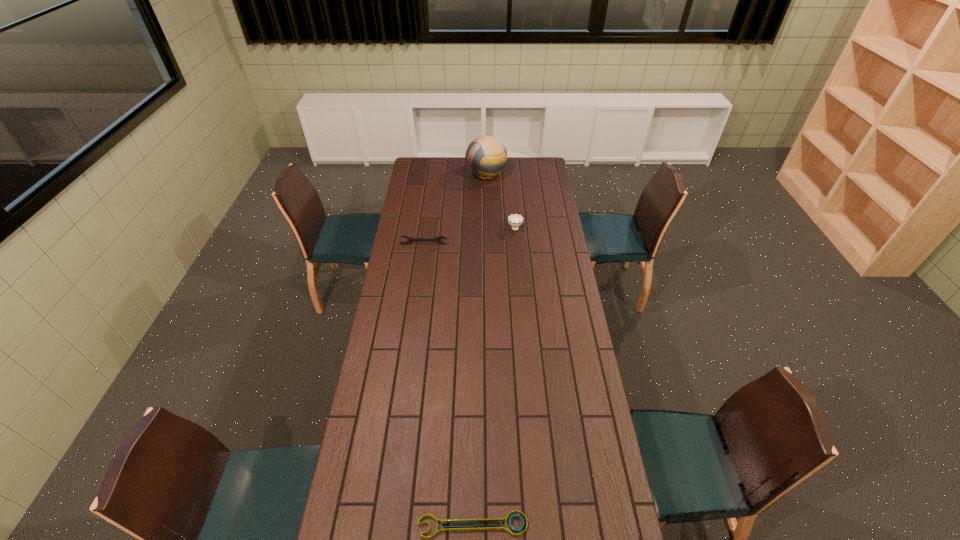
Where is `object that is the nearest to the second nearest object`? The height and width of the screenshot is (540, 960). object that is the nearest to the second nearest object is located at coordinates (515, 220).

Find the location of `the second closest object to the second nearest object`. the second closest object to the second nearest object is located at coordinates (486, 157).

You are a GUI agent. You are given a task and a screenshot of the screen. Output one action in this format:
    pyautogui.click(x=<x>, y=<y>)
    Task: Click on the free space in the image that satisfies the following two spatial constraints: 1. on the open ends of the taller wrench; 2. on the right side of the shortest object
    This screenshot has width=960, height=540.
    Given the screenshot: What is the action you would take?
    pyautogui.click(x=386, y=525)

Where is `free space that satisfies the following two spatial constraints: 1. on the open ends of the third farthest object; 2. on the right side of the shorter wrench`? free space that satisfies the following two spatial constraints: 1. on the open ends of the third farthest object; 2. on the right side of the shorter wrench is located at coordinates (386, 525).

You are a GUI agent. You are given a task and a screenshot of the screen. Output one action in this format:
    pyautogui.click(x=<x>, y=<y>)
    Task: Click on the free space that satisfies the following two spatial constraints: 1. on the open ends of the second shortest object; 2. on the right side of the shorter wrench
    
    Given the screenshot: What is the action you would take?
    pyautogui.click(x=386, y=525)

Where is `free location that satisfies the following two spatial constraints: 1. on the open ends of the second nearest object; 2. on the left side of the shortest object`? The height and width of the screenshot is (540, 960). free location that satisfies the following two spatial constraints: 1. on the open ends of the second nearest object; 2. on the left side of the shortest object is located at coordinates (386, 525).